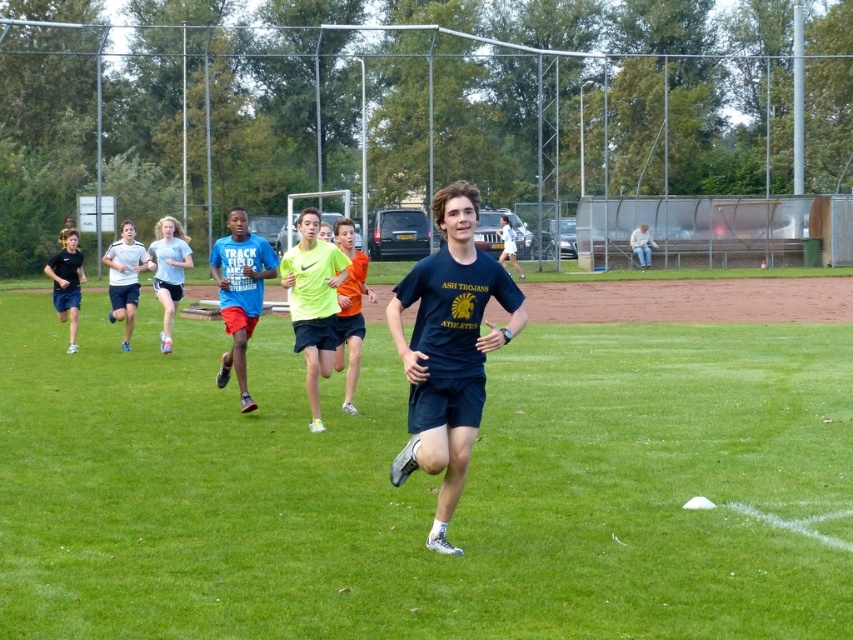
From the picture: You are a photographer trying to capture the entire scene of the running athletes. You notice the green grass at center and the dark blue athletic wear at center. Which object would appear bigger in your photo?

The green grass at center appears bigger in the photo because it is larger in size than the dark blue athletic wear at center.

You are a photographer positioned at the back of the field. You want to take a photo that includes both the neon green athletic shorts at center and the light blue athletic shorts at left. Based on their positions, which athlete should you adjust your camera angle to focus on first to ensure both are in frame?

The neon green athletic shorts at center is located below the light blue athletic shorts at left. To capture both in the frame, focus on the light blue athletic shorts at left first since it is higher up, then adjust the angle to include the lower positioned neon green athletic shorts at center.